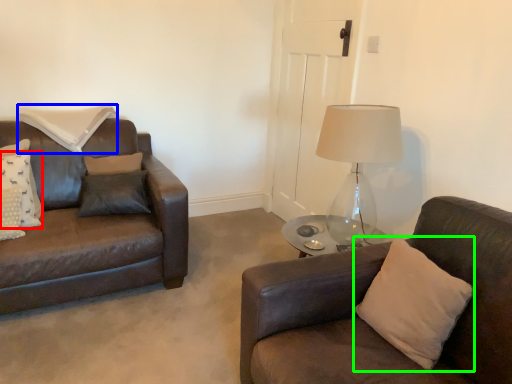
Question: Which object is the closest to the pillow (highlighted by a red box)? Choose among these: pillow (highlighted by a blue box) or pillow (highlighted by a green box).

Choices:
 (A) pillow
 (B) pillow

Answer: (A)